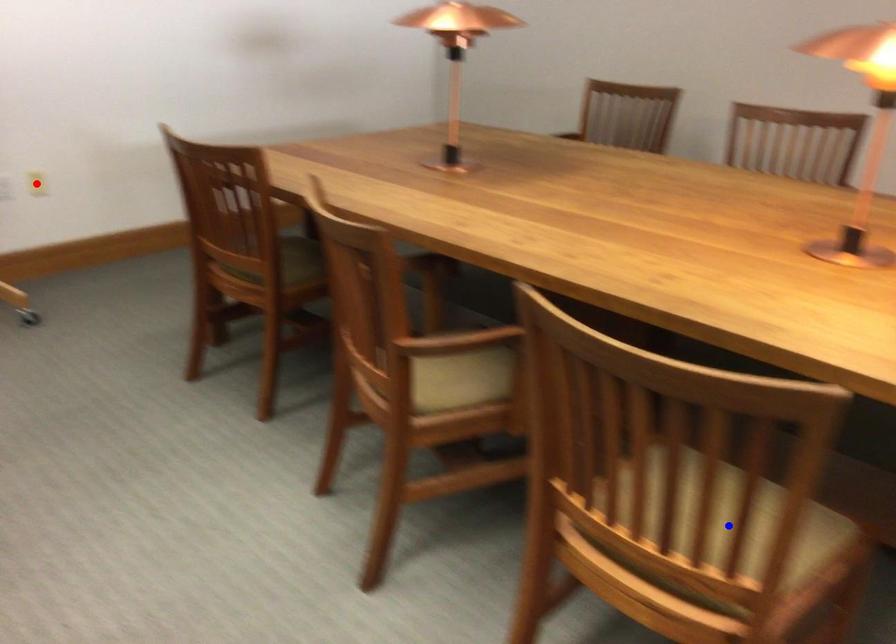
Question: Two points are marked on the image. Which point is closer to the camera?

Choices:
 (A) Blue point is closer.
 (B) Red point is closer.

Answer: (A)